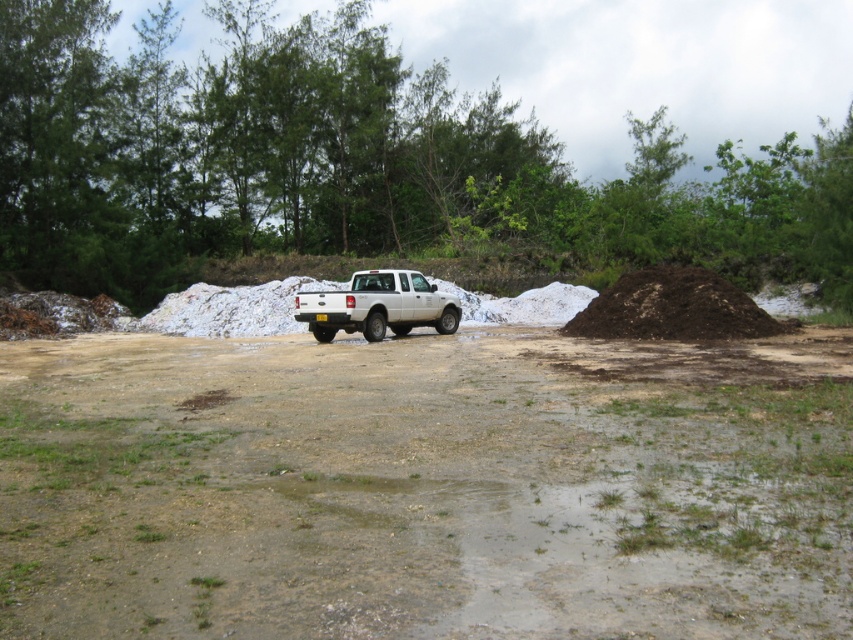
Question: Is dull brown dirt at center behind dark brown soil at right?

Choices:
 (A) yes
 (B) no

Answer: (B)

Question: Which of the following is the closest to the observer?

Choices:
 (A) white matte truck at center
 (B) dull brown dirt at center
 (C) dark brown soil at right
 (D) green leafy tree at upper center

Answer: (B)

Question: Is dull brown dirt at center wider than dark brown soil at right?

Choices:
 (A) no
 (B) yes

Answer: (B)

Question: Does dull brown dirt at center appear over white matte truck at center?

Choices:
 (A) yes
 (B) no

Answer: (B)

Question: Which of the following is the closest to the observer?

Choices:
 (A) dull brown dirt at center
 (B) dark brown soil at right
 (C) white matte truck at center

Answer: (A)

Question: Estimate the real-world distances between objects in this image. Which object is closer to the white matte truck at center?

Choices:
 (A) green leafy tree at upper center
 (B) dull brown dirt at center
 (C) dark brown soil at right

Answer: (C)